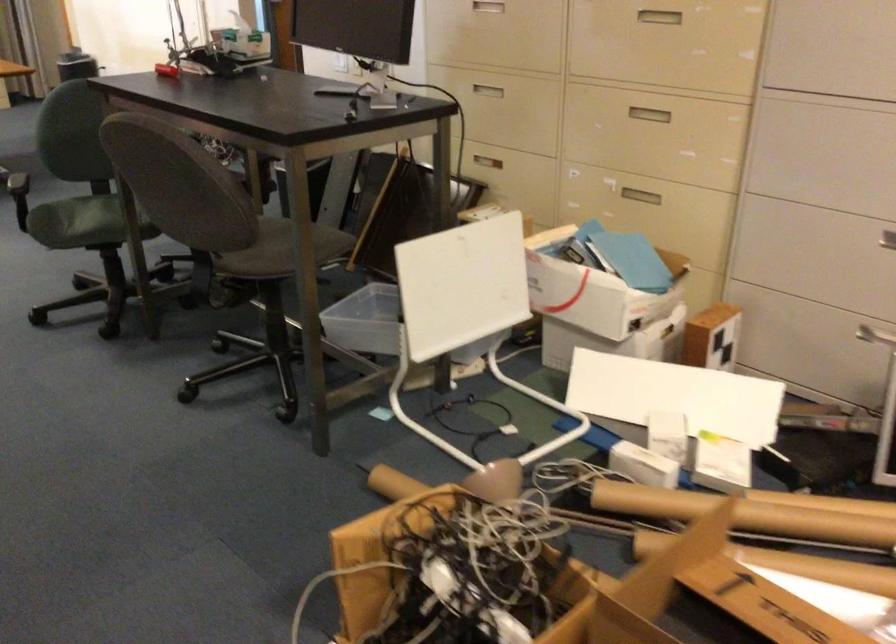
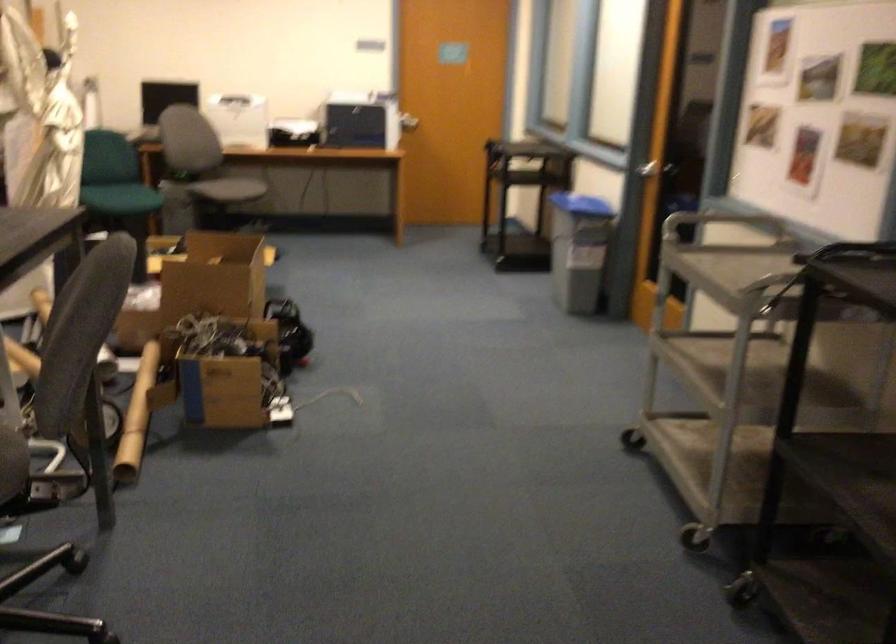
Locate, in the second image, the point that corresponds to (392,564) in the first image.

(227, 390)